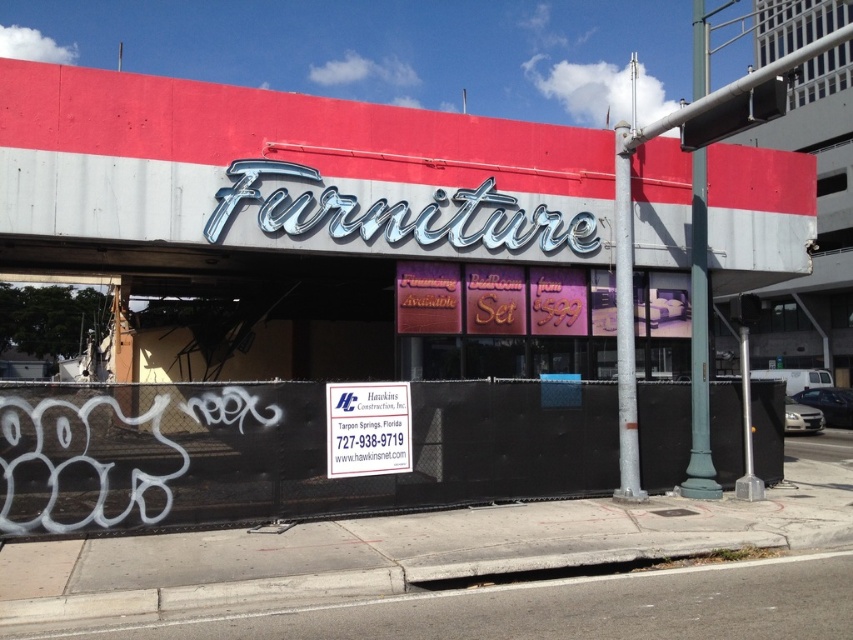
Does point (163, 417) come closer to viewer compared to point (355, 412)?

Yes, it is.

Does metallic signboard at center have a smaller size compared to white plastic sign at center?

Incorrect, metallic signboard at center is not smaller in size than white plastic sign at center.

Measure the distance between metallic signboard at center and camera.

metallic signboard at center is 7.99 meters from camera.

At what (x,y) coordinates should I click in order to perform the action: click on metallic signboard at center. Please return your answer as a coordinate pair (x, y). Looking at the image, I should click on (300, 298).